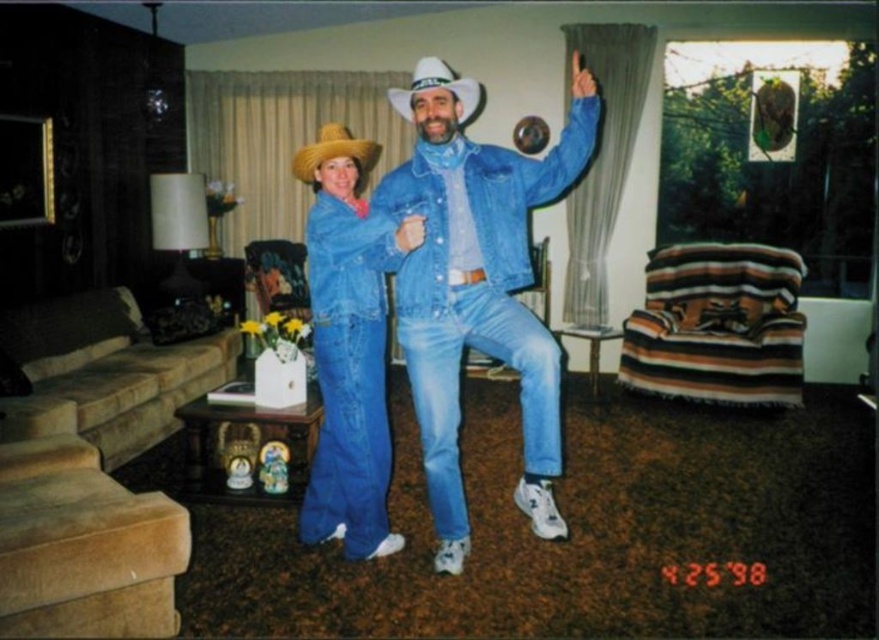
Does denim jacket at center lie behind white denim cowboy hat at upper center?

That is False.

Does denim jacket at center have a greater width compared to white denim cowboy hat at upper center?

Yes.

Identify the location of denim jacket at center. (349, 344).

I want to click on denim blue jeans at center, so click(478, 294).

Is point (534, 481) positioned behind point (327, 141)?

That is False.

Measure the distance between point (553, 369) and camera.

They are 8.27 feet apart.

At what (x,y) coordinates should I click in order to perform the action: click on denim blue jeans at center. Please return your answer as a coordinate pair (x, y). The height and width of the screenshot is (640, 879). Looking at the image, I should click on (478, 294).

Which is in front, point (339, 358) or point (331, 141)?

Point (331, 141) is in front.

Which of these two, denim jacket at center or natural straw cowboy hat at center, stands taller?

denim jacket at center is taller.

Who is more distant from viewer, [419,237] or [340,132]?

Positioned behind is point [340,132].

Locate an element on the screen. This screenshot has height=640, width=879. denim jacket at center is located at coordinates (349, 344).